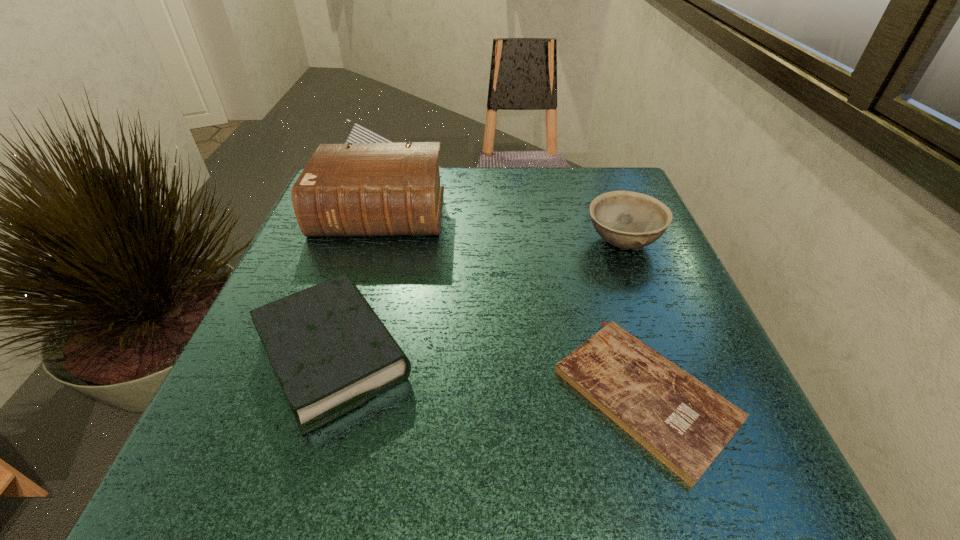
Image resolution: width=960 pixels, height=540 pixels. Identify the location of object situated at the far edge. (365, 189).

Locate an element on the screen. bowl present at the right edge is located at coordinates (629, 220).

At what (x,y) coordinates should I click in order to perform the action: click on Bible that is at the right edge. Please return your answer as a coordinate pair (x, y). The image size is (960, 540). Looking at the image, I should click on (685, 424).

What are the coordinates of `object at the far left corner` in the screenshot? It's located at (365, 189).

At what (x,y) coordinates should I click in order to perform the action: click on object at the near left corner. Please return your answer as a coordinate pair (x, y). This screenshot has width=960, height=540. Looking at the image, I should click on (331, 353).

Image resolution: width=960 pixels, height=540 pixels. In order to click on object present at the near right corner in this screenshot , I will do `click(685, 424)`.

Image resolution: width=960 pixels, height=540 pixels. I want to click on vacant space at the far edge, so click(465, 185).

Identify the location of vacant space at the near edge of the desktop. This screenshot has width=960, height=540. (373, 443).

Where is `free location at the left edge`? free location at the left edge is located at coordinates (231, 392).

Find the location of a particular element. This screenshot has height=540, width=960. vacant space at the right edge of the desktop is located at coordinates (676, 306).